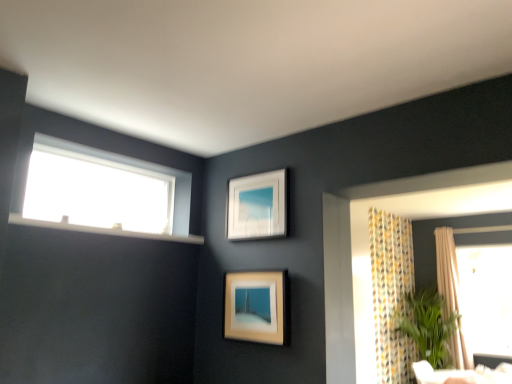
I want to click on beige textured curtain at right, so click(x=447, y=269).

At what (x,y) coordinates should I click in order to perform the action: click on beige textured curtain at right. Please return your answer as a coordinate pair (x, y). The image size is (512, 384). Looking at the image, I should click on (447, 269).

Is point (442, 320) more distant than point (240, 283)?

Yes.

Is green leafy plant at right oriented away from matte wooden picture frame at center, which is the 1th picture frame from bottom to top?

No.

Where is `picture frame that is the 1st object above the green leafy plant at right (from a real-world perspective)`? The width and height of the screenshot is (512, 384). picture frame that is the 1st object above the green leafy plant at right (from a real-world perspective) is located at coordinates (256, 307).

Is green leafy plant at right not near matte wooden picture frame at center, the 2th picture frame when ordered from top to bottom?

Yes, green leafy plant at right is far from matte wooden picture frame at center, the 2th picture frame when ordered from top to bottom.

Which is behind, point (419, 311) or point (253, 222)?

Positioned behind is point (419, 311).

Could you tell me if green leafy plant at right is facing white matte picture frame at upper center, the 1th picture frame when ordered from top to bottom?

Yes, green leafy plant at right is facing white matte picture frame at upper center, the 1th picture frame when ordered from top to bottom.

Does green leafy plant at right appear on the right side of white matte picture frame at upper center, which appears as the second picture frame when ordered from the bottom?

Indeed, green leafy plant at right is positioned on the right side of white matte picture frame at upper center, which appears as the second picture frame when ordered from the bottom.

From a real-world perspective, between green leafy plant at right and white matte picture frame at upper center, the 1th picture frame when ordered from top to bottom, who is vertically lower?

green leafy plant at right is physically lower.

How distant is white matte picture frame at upper center, the 1th picture frame when ordered from top to bottom, from matte wooden picture frame at center, the 2th picture frame when ordered from top to bottom?

white matte picture frame at upper center, the 1th picture frame when ordered from top to bottom, is 16.78 inches from matte wooden picture frame at center, the 2th picture frame when ordered from top to bottom.

Is white matte picture frame at upper center, the 1th picture frame when ordered from top to bottom, closer to the viewer compared to matte wooden picture frame at center, which is the 1th picture frame from bottom to top?

That is False.

From a real-world perspective, is white matte picture frame at upper center, the 1th picture frame when ordered from top to bottom, positioned above or below matte wooden picture frame at center, the 2th picture frame when ordered from top to bottom?

In terms of real-world spatial position, white matte picture frame at upper center, the 1th picture frame when ordered from top to bottom, is above matte wooden picture frame at center, the 2th picture frame when ordered from top to bottom.

Does white matte picture frame at upper center, which appears as the second picture frame when ordered from the bottom, turn towards matte wooden picture frame at center, the 2th picture frame when ordered from top to bottom?

No, white matte picture frame at upper center, which appears as the second picture frame when ordered from the bottom, does not turn towards matte wooden picture frame at center, the 2th picture frame when ordered from top to bottom.

From the image's perspective, is green leafy plant at right under transparent glass window at upper left?

Yes, from the image's perspective, green leafy plant at right is beneath transparent glass window at upper left.

Between green leafy plant at right and transparent glass window at upper left, which one appears on the right side from the viewer's perspective?

From the viewer's perspective, green leafy plant at right appears more on the right side.

Which of these two, green leafy plant at right or transparent glass window at upper left, stands taller?

With more height is green leafy plant at right.

Consider the image. Can you confirm if green leafy plant at right is wider than transparent glass window at upper left?

Indeed, green leafy plant at right has a greater width compared to transparent glass window at upper left.

Is point (253, 309) less distant than point (176, 193)?

That is True.

Could transparent glass window at upper left be considered to be inside matte wooden picture frame at center, which is the 1th picture frame from bottom to top?

No, transparent glass window at upper left is not inside matte wooden picture frame at center, which is the 1th picture frame from bottom to top.

Is matte wooden picture frame at center, the 2th picture frame when ordered from top to bottom, far from transparent glass window at upper left?

matte wooden picture frame at center, the 2th picture frame when ordered from top to bottom, is near transparent glass window at upper left, not far away.

From a real-world perspective, is matte wooden picture frame at center, which is the 1th picture frame from bottom to top, positioned under transparent glass window at upper left based on gravity?

Yes, from a real-world perspective, matte wooden picture frame at center, which is the 1th picture frame from bottom to top, is below transparent glass window at upper left.

In terms of height, does beige textured curtain at right look taller or shorter compared to white plastic window sill at upper left?

Considering their sizes, beige textured curtain at right has more height than white plastic window sill at upper left.

Consider the image. Considering the sizes of beige textured curtain at right and white plastic window sill at upper left in the image, is beige textured curtain at right wider or thinner than white plastic window sill at upper left?

beige textured curtain at right is wider than white plastic window sill at upper left.

From a real-world perspective, which is physically above, beige textured curtain at right or white plastic window sill at upper left?

From a 3D spatial view, white plastic window sill at upper left is above.

Considering the relative sizes of green leafy plant at right and white plastic window sill at upper left in the image provided, is green leafy plant at right thinner than white plastic window sill at upper left?

Incorrect, the width of green leafy plant at right is not less than that of white plastic window sill at upper left.

Is green leafy plant at right taller or shorter than white plastic window sill at upper left?

green leafy plant at right is taller than white plastic window sill at upper left.

From a real-world perspective, who is located higher, green leafy plant at right or white plastic window sill at upper left?

white plastic window sill at upper left.

From the picture: Is green leafy plant at right in contact with white plastic window sill at upper left?

green leafy plant at right and white plastic window sill at upper left are not in contact.

The image size is (512, 384). In the image, there is a matte wooden picture frame at center, which is the 1th picture frame from bottom to top. In order to click on plant below it (from a real-world perspective) in this screenshot , I will do `click(426, 325)`.

Where is `plant on the right side of white matte picture frame at upper center, the 1th picture frame when ordered from top to bottom`? The image size is (512, 384). plant on the right side of white matte picture frame at upper center, the 1th picture frame when ordered from top to bottom is located at coordinates (426, 325).

Looking at the image, which one is located further to matte wooden picture frame at center, which is the 1th picture frame from bottom to top, green leafy plant at right or transparent glass window at upper left?

The object further to matte wooden picture frame at center, which is the 1th picture frame from bottom to top, is green leafy plant at right.

From the image, which object appears to be farther from white plastic window sill at upper left, beige textured curtain at right or transparent glass window at upper left?

The object further to white plastic window sill at upper left is beige textured curtain at right.

Based on their spatial positions, is matte wooden picture frame at center, which is the 1th picture frame from bottom to top, or beige textured curtain at right closer to transparent glass window at upper left?

The object closer to transparent glass window at upper left is matte wooden picture frame at center, which is the 1th picture frame from bottom to top.

When comparing their distances from green leafy plant at right, does white matte picture frame at upper center, the 1th picture frame when ordered from top to bottom, or beige textured curtain at right seem further?

white matte picture frame at upper center, the 1th picture frame when ordered from top to bottom, is positioned further to the anchor green leafy plant at right.

From the image, which object appears to be nearer to matte wooden picture frame at center, the 2th picture frame when ordered from top to bottom, transparent glass window at upper left or white matte picture frame at upper center, which appears as the second picture frame when ordered from the bottom?

The object closer to matte wooden picture frame at center, the 2th picture frame when ordered from top to bottom, is white matte picture frame at upper center, which appears as the second picture frame when ordered from the bottom.

Which object lies further to the anchor point transparent glass window at upper left, white plastic window sill at upper left or beige textured curtain at right?

beige textured curtain at right is positioned further to the anchor transparent glass window at upper left.

Which object lies nearer to the anchor point transparent glass window at upper left, beige textured curtain at right or white matte picture frame at upper center, which appears as the second picture frame when ordered from the bottom?

Based on the image, white matte picture frame at upper center, which appears as the second picture frame when ordered from the bottom, appears to be nearer to transparent glass window at upper left.

When comparing their distances from matte wooden picture frame at center, the 2th picture frame when ordered from top to bottom, does green leafy plant at right or white plastic window sill at upper left seem closer?

white plastic window sill at upper left.

Where is `plant between white matte picture frame at upper center, the 1th picture frame when ordered from top to bottom, and beige textured curtain at right from left to right`? plant between white matte picture frame at upper center, the 1th picture frame when ordered from top to bottom, and beige textured curtain at right from left to right is located at coordinates (426, 325).

Identify the location of window sill between transparent glass window at upper left and white matte picture frame at upper center, the 1th picture frame when ordered from top to bottom. (104, 230).

At what (x,y) coordinates should I click in order to perform the action: click on window sill between transparent glass window at upper left and beige textured curtain at right in the horizontal direction. Please return your answer as a coordinate pair (x, y). Looking at the image, I should click on (104, 230).

Find the location of `picture frame situated between transparent glass window at upper left and white matte picture frame at upper center, the 1th picture frame when ordered from top to bottom, from left to right`. picture frame situated between transparent glass window at upper left and white matte picture frame at upper center, the 1th picture frame when ordered from top to bottom, from left to right is located at coordinates (256, 307).